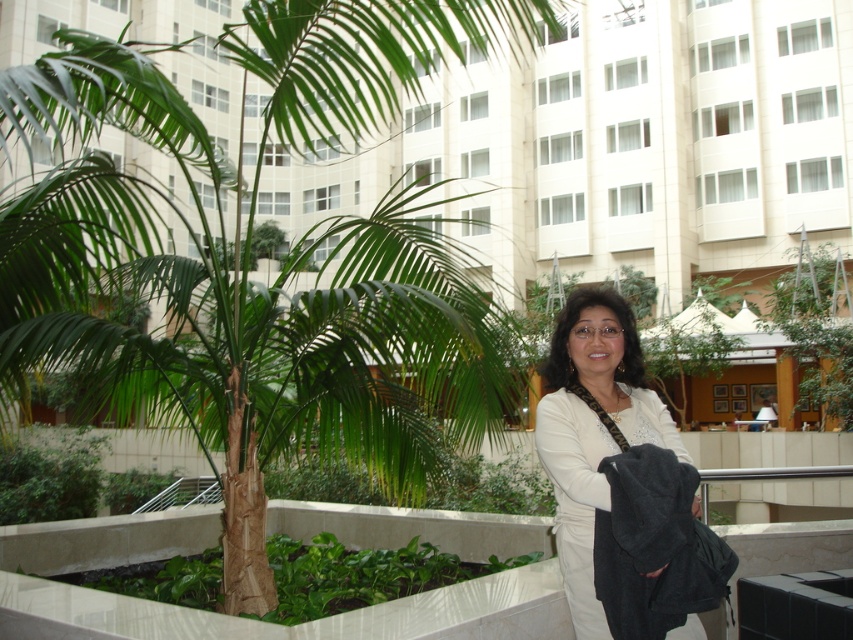
You are standing at the entrance of the building and want to take a photo of the green leafy palm tree at center. Based on its position, which direction should you face to capture it in your shot?

The green leafy palm tree at center is located at coordinates (228, 304), which places it in the center of the scene. To capture it, you should face directly towards the center of the building area where the palm tree is situated.

You are a photographer planning to capture a full view of both the green leafy palm tree at center and the white matte jacket at center from a distance. Which object will require a wider angle lens to include its entire width in the photo?

The green leafy palm tree at center requires a wider angle lens because its width surpasses that of the white matte jacket at center, necessitating a wider field of view to capture its entire width.

You are a photographer trying to capture both the green leafy palm tree at center and the white matte jacket at center in the same frame. Based on their sizes, which object should you focus on first to ensure both are in the frame?

The green leafy palm tree at center is much taller than the white matte jacket at center, so you should focus on the palm tree first to ensure it fits within the frame while also capturing the jacket.